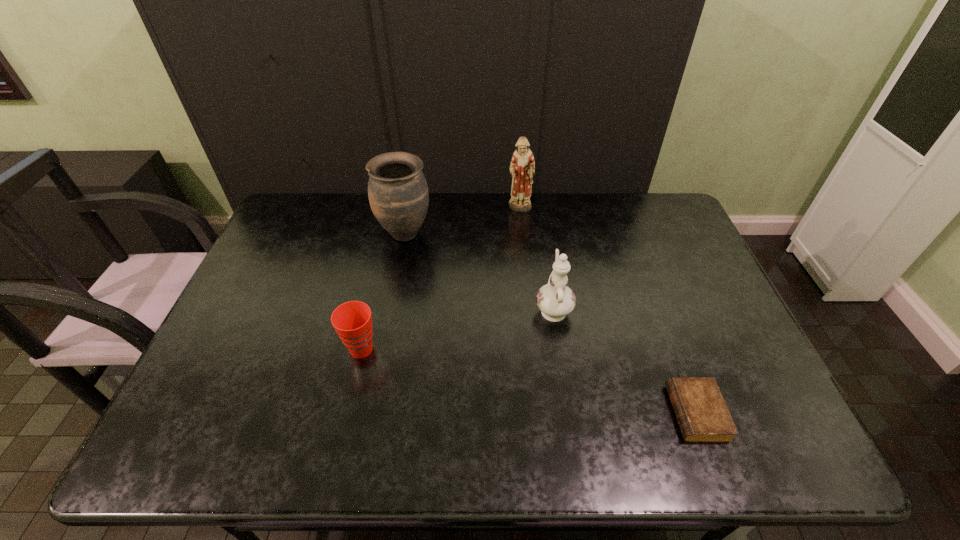
At what (x,y) coordinates should I click in order to perform the action: click on free space located 0.340m at the spout of the third farthest object. Please return your answer as a coordinate pair (x, y). Looking at the image, I should click on (540, 219).

Locate an element on the screen. The height and width of the screenshot is (540, 960). vacant space located 0.370m at the spout of the third farthest object is located at coordinates (539, 214).

I want to click on free location located at the spout of the third farthest object, so click(544, 250).

Locate an element on the screen. The width and height of the screenshot is (960, 540). free space located 0.120m on the right of the second nearest object is located at coordinates (426, 349).

Where is `vacant space located on the spine side of the shortest object`? vacant space located on the spine side of the shortest object is located at coordinates (629, 413).

Find the location of `vacant space located on the spine side of the shortest object`. vacant space located on the spine side of the shortest object is located at coordinates (603, 413).

You are a GUI agent. You are given a task and a screenshot of the screen. Output one action in this format:
    pyautogui.click(x=<x>, y=<y>)
    Task: Click on the vacant space situated on the spine side of the shortest object
    
    Given the screenshot: What is the action you would take?
    (x=603, y=413)

Locate an element on the screen. The height and width of the screenshot is (540, 960). figurine present at the far edge is located at coordinates (522, 168).

Where is `urn that is at the far edge`? urn that is at the far edge is located at coordinates (398, 194).

Image resolution: width=960 pixels, height=540 pixels. I want to click on object at the near edge, so click(702, 415).